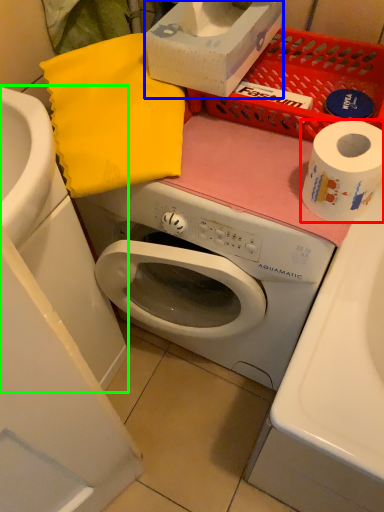
Question: Estimate the real-world distances between objects in this image. Which object is closer to toilet paper (highlighted by a red box), box (highlighted by a blue box) or sink (highlighted by a green box)?

Choices:
 (A) box
 (B) sink

Answer: (A)